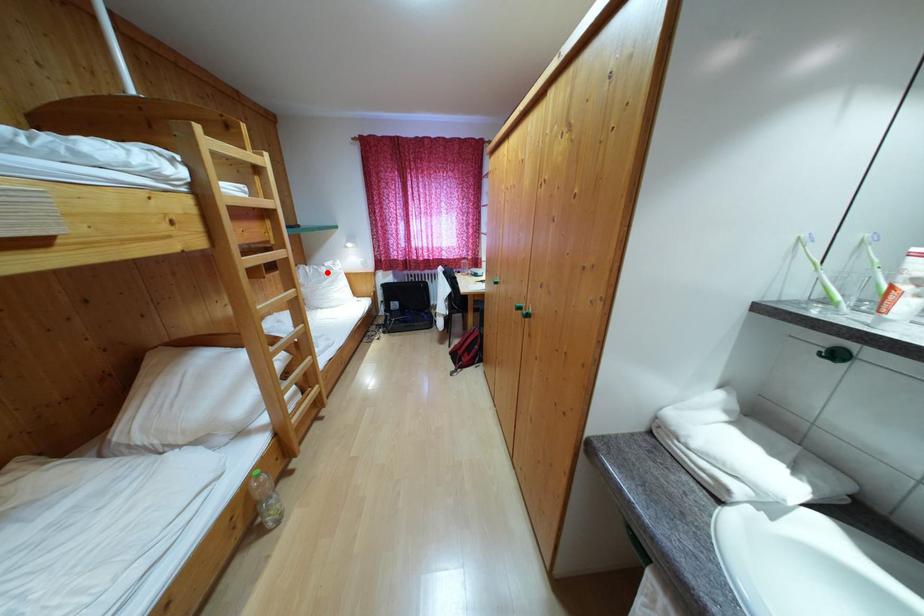
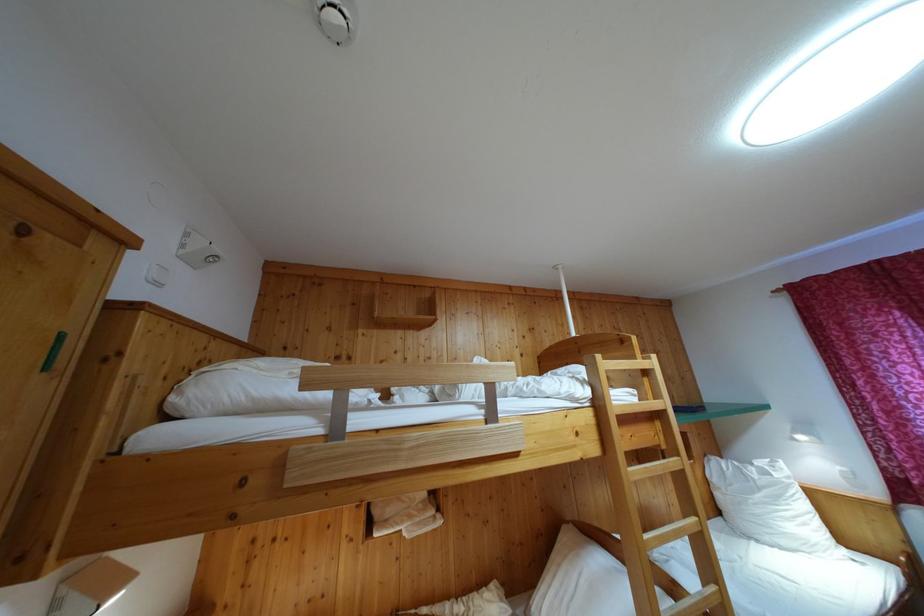
Question: I am providing you with two images of the same scene from different viewpoints. Given a red point in image1, look at the same physical point in image2. Is it:

Choices:
 (A) Closer to the viewpoint
 (B) Farther from the viewpoint

Answer: (B)